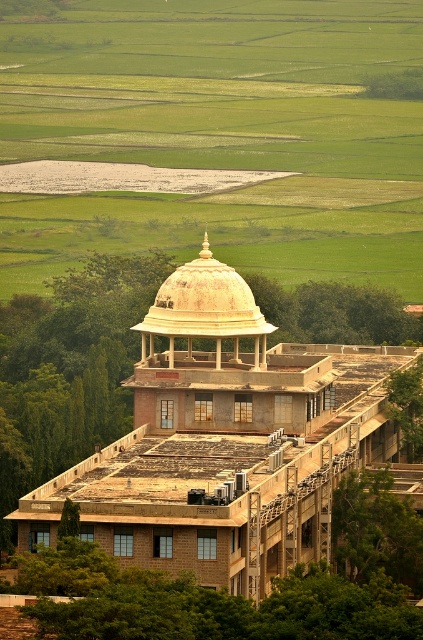
Between beige stone dome at center and golden textured dome at center, which one is positioned higher?

Positioned higher is golden textured dome at center.

In the scene shown: Is beige stone dome at center smaller than golden textured dome at center?

No.

What are the coordinates of `beige stone dome at center` in the screenshot? It's located at (225, 442).

Can you confirm if green grass at upper center is bigger than golden textured dome at center?

Indeed, green grass at upper center has a larger size compared to golden textured dome at center.

Measure the distance between point (134, 1) and camera.

Point (134, 1) and camera are 432.93 meters apart.

Identify the location of green grass at upper center. (219, 134).

Is green grass at upper center thinner than beige stone dome at center?

In fact, green grass at upper center might be wider than beige stone dome at center.

Who is taller, green grass at upper center or beige stone dome at center?

With more height is green grass at upper center.

Is point (378, 211) closer to viewer compared to point (231, 404)?

No, (378, 211) is behind (231, 404).

Where is `green grass at upper center`? green grass at upper center is located at coordinates (219, 134).